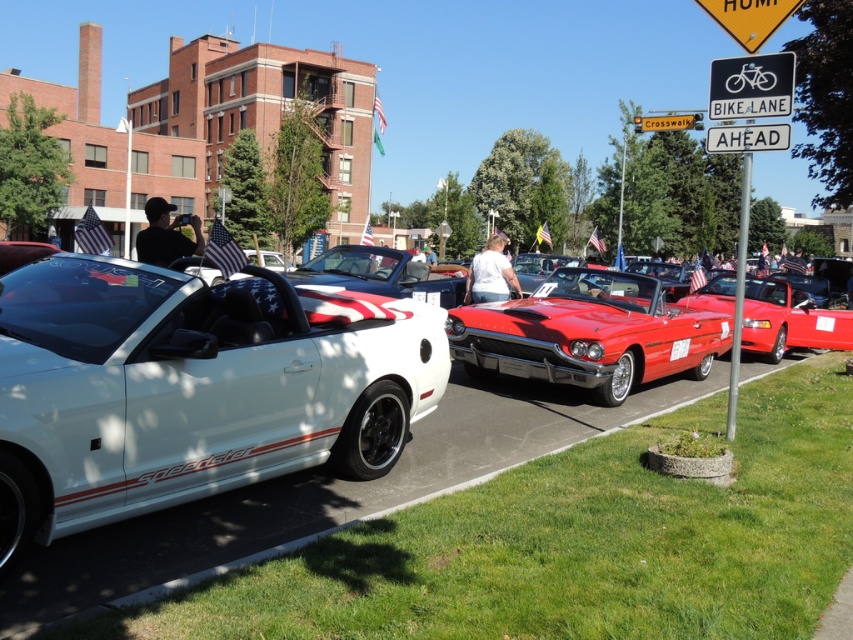
You are a delivery person trying to drive a 2.5 meters tall truck through the area. You see the shiny red convertible at center and the black plastic bike lane sign at upper center. Which object might block the truck from passing through?

The black plastic bike lane sign at upper center might block the truck from passing through because the shiny red convertible at center has a lesser height compared to black plastic bike lane sign at upper center, and the truck is 2.5 meters tall.

You are standing at the camera position and want to take a photo of the shiny red convertible at center. If your camera has a maximum focus range of 25 feet, will you be able to capture it clearly?

The shiny red convertible at center and camera are 26.07 feet apart from each other. Since the camera can only focus up to 25 feet, you won cannot capture it clearly.

You are a photographer planning to take a photo of the white matte convertible at left and the shiny red convertible at center. If you want to ensure both cars are fully visible in the frame, which car should you focus on first to avoid cropping the top of the cars?

You should focus on the shiny red convertible at center first because it is taller than the white matte convertible at left, so ensuring it fits properly will help accommodate the shorter car within the frame.